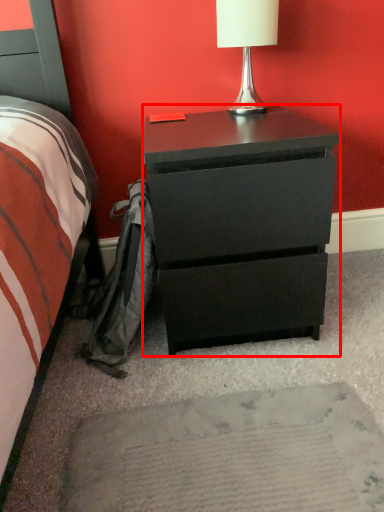
Question: From the image, what is the correct spatial relationship of chest of drawers (annotated by the red box) in relation to table lamp?

Choices:
 (A) right
 (B) left

Answer: (B)